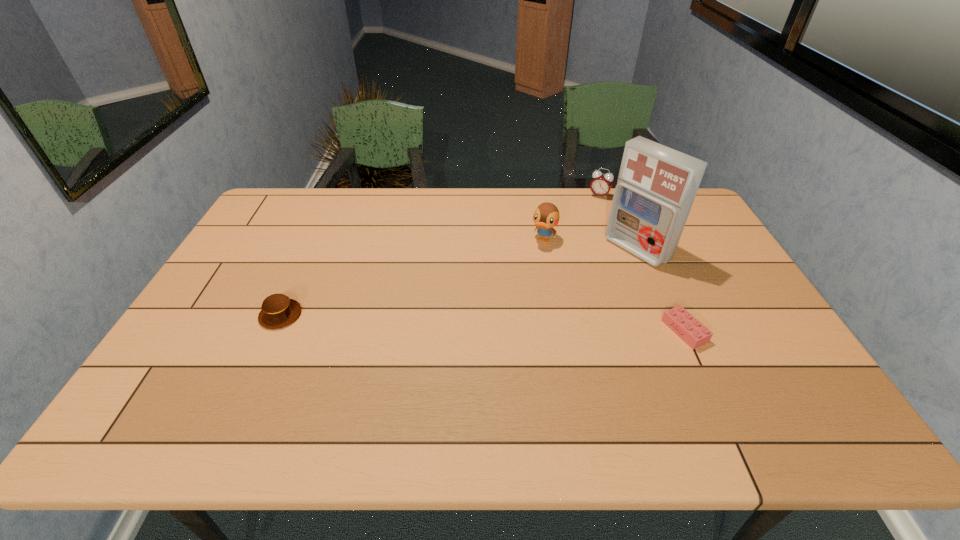
The image size is (960, 540). I want to click on vacant region located on the clock face of the alarm clock, so click(576, 239).

Locate an element on the screen. Image resolution: width=960 pixels, height=540 pixels. blank area located on the clock face of the alarm clock is located at coordinates (590, 211).

Identify the location of blank space located 0.370m on the clock face of the alarm clock. The image size is (960, 540). (565, 258).

Where is `vacant area located 0.300m on the front-facing side of the second object from left to right`? vacant area located 0.300m on the front-facing side of the second object from left to right is located at coordinates (504, 311).

Find the location of a particular element. Image resolution: width=960 pixels, height=540 pixels. blank space located 0.320m on the front-facing side of the second object from left to right is located at coordinates (502, 316).

Find the location of a particular element. vacant area located on the front-facing side of the second object from left to right is located at coordinates (518, 286).

This screenshot has height=540, width=960. I want to click on vacant area situated on the front-facing side of the tallest object, so click(x=598, y=276).

This screenshot has width=960, height=540. I want to click on vacant point located on the front-facing side of the tallest object, so click(x=527, y=322).

Identify the location of vacant space located 0.140m on the front-facing side of the tallest object. 588,282.

Identify the location of object located at the far edge. The height and width of the screenshot is (540, 960). (601, 184).